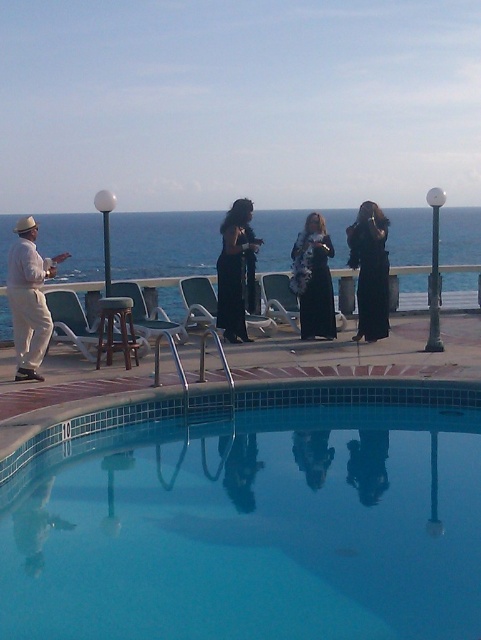
Question: Does transparent glass pool at center appear under black fabric chair at center?

Choices:
 (A) yes
 (B) no

Answer: (A)

Question: Which of the following is the closest to the observer?

Choices:
 (A) transparent glass pool at center
 (B) wooden stool at center
 (C) black dress at center

Answer: (A)

Question: Considering the relative positions of transparent glass pool at center and wooden stool at center in the image provided, where is transparent glass pool at center located with respect to wooden stool at center?

Choices:
 (A) left
 (B) right

Answer: (B)

Question: Which point is closer to the camera?

Choices:
 (A) (278, 317)
 (B) (55, 339)
 (C) (358, 330)

Answer: (B)

Question: Considering the relative positions of transparent glass pool at center and white cotton shirt at left in the image provided, where is transparent glass pool at center located with respect to white cotton shirt at left?

Choices:
 (A) below
 (B) above

Answer: (A)

Question: Considering the real-world distances, which object is farthest from the metallic silver chair at center?

Choices:
 (A) transparent glass pool at center
 (B) black satin dress at center
 (C) black fabric chair at center
 (D) black dress at center

Answer: (A)